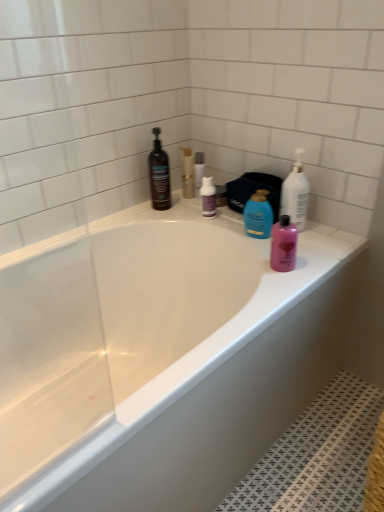
What do you see at coordinates (162, 355) in the screenshot? Image resolution: width=384 pixels, height=512 pixels. I see `white glossy bathtub at upper center` at bounding box center [162, 355].

The height and width of the screenshot is (512, 384). Identify the location of white glossy bathtub at upper center. (162, 355).

Locate an element on the screen. white glossy bottle at upper right, the 4th cleaning product in the left-to-right sequence is located at coordinates (295, 193).

Where is `purple matte bottle at center, which is the 2th cleaning product in left-to-right order`? purple matte bottle at center, which is the 2th cleaning product in left-to-right order is located at coordinates (208, 197).

Find the location of `pink glossy bottle at right, the third toiletry when ordered from left to right`. pink glossy bottle at right, the third toiletry when ordered from left to right is located at coordinates (283, 245).

Image resolution: width=384 pixels, height=512 pixels. Describe the element at coordinates (187, 173) in the screenshot. I see `gold metallic soap dispenser at upper center, marked as the first toiletry in a back-to-front arrangement` at that location.

How much space does gold metallic soap dispenser at upper center, which is the first toiletry in left-to-right order, occupy vertically?

The height of gold metallic soap dispenser at upper center, which is the first toiletry in left-to-right order, is 17.37 centimeters.

Locate an element on the screen. Image resolution: width=384 pixels, height=512 pixels. white glossy bathtub at upper center is located at coordinates [162, 355].

Based on their sizes in the image, would you say pink glossy bottle at right, acting as the first toiletry starting from the front, is bigger or smaller than clear plastic bottle at upper center, the second toiletry viewed from the left?

pink glossy bottle at right, acting as the first toiletry starting from the front, is bigger than clear plastic bottle at upper center, the second toiletry viewed from the left.

The image size is (384, 512). I want to click on the 1st toiletry to the left of the pink glossy bottle at right, acting as the first toiletry starting from the front, counting from the anchor's position, so click(199, 168).

Would you say pink glossy bottle at right, the third toiletry from the back, contains clear plastic bottle at upper center, marked as the 2th toiletry in a top-to-bottom arrangement?

No.

Looking at this image, between pink glossy bottle at right, the first toiletry in the bottom-to-top sequence, and clear plastic bottle at upper center, which is the 2th toiletry from back to front, which one appears on the left side from the viewer's perspective?

clear plastic bottle at upper center, which is the 2th toiletry from back to front, is more to the left.

From a real-world perspective, which object rests below the other?

In real-world perspective, blue glossy bottle at upper center, the second cleaning product when ordered from right to left, is lower.

Considering the relative sizes of blue glossy bottle at upper center, placed as the 3th cleaning product when sorted from left to right, and white glossy bottle at upper right, which ranks as the first cleaning product in right-to-left order, in the image provided, is blue glossy bottle at upper center, placed as the 3th cleaning product when sorted from left to right, wider than white glossy bottle at upper right, which ranks as the first cleaning product in right-to-left order,?

No, blue glossy bottle at upper center, placed as the 3th cleaning product when sorted from left to right, is not wider than white glossy bottle at upper right, which ranks as the first cleaning product in right-to-left order.

From their relative heights in the image, would you say blue glossy bottle at upper center, placed as the 3th cleaning product when sorted from left to right, is taller or shorter than white glossy bottle at upper right, which ranks as the first cleaning product in right-to-left order?

Clearly, blue glossy bottle at upper center, placed as the 3th cleaning product when sorted from left to right, is shorter compared to white glossy bottle at upper right, which ranks as the first cleaning product in right-to-left order.

Would you consider blue glossy bottle at upper center, the second cleaning product when ordered from right to left, to be distant from white glossy bottle at upper right, which ranks as the first cleaning product in right-to-left order?

No, blue glossy bottle at upper center, the second cleaning product when ordered from right to left, is not far away from white glossy bottle at upper right, which ranks as the first cleaning product in right-to-left order.

Is blue glossy bottle at upper center, placed as the 3th cleaning product when sorted from left to right, inside the boundaries of gold metallic soap dispenser at upper center, marked as the 3th toiletry in a right-to-left arrangement, or outside?

blue glossy bottle at upper center, placed as the 3th cleaning product when sorted from left to right, cannot be found inside gold metallic soap dispenser at upper center, marked as the 3th toiletry in a right-to-left arrangement.

From a real-world perspective, is blue glossy bottle at upper center, the second cleaning product when ordered from right to left, positioned above or below gold metallic soap dispenser at upper center, which is the first toiletry in left-to-right order?

blue glossy bottle at upper center, the second cleaning product when ordered from right to left, is situated lower than gold metallic soap dispenser at upper center, which is the first toiletry in left-to-right order, in the real world.

Is blue glossy bottle at upper center, placed as the 3th cleaning product when sorted from left to right, placed right next to gold metallic soap dispenser at upper center, marked as the third toiletry in a front-to-back arrangement?

No, blue glossy bottle at upper center, placed as the 3th cleaning product when sorted from left to right, is not beside gold metallic soap dispenser at upper center, marked as the third toiletry in a front-to-back arrangement.

In the image, is blue glossy bottle at upper center, placed as the 3th cleaning product when sorted from left to right, on the left side or the right side of gold metallic soap dispenser at upper center, marked as the third toiletry in a front-to-back arrangement?

blue glossy bottle at upper center, placed as the 3th cleaning product when sorted from left to right, is positioned on gold metallic soap dispenser at upper center, marked as the third toiletry in a front-to-back arrangement,'s right side.

Is white glossy bottle at upper right, which ranks as the first cleaning product in right-to-left order, at the back of gold metallic soap dispenser at upper center, placed as the third toiletry when sorted from bottom to top?

gold metallic soap dispenser at upper center, placed as the third toiletry when sorted from bottom to top, does not have its back to white glossy bottle at upper right, which ranks as the first cleaning product in right-to-left order.

Is gold metallic soap dispenser at upper center, placed as the third toiletry when sorted from bottom to top, positioned beyond the bounds of white glossy bottle at upper right, which ranks as the first cleaning product in right-to-left order?

gold metallic soap dispenser at upper center, placed as the third toiletry when sorted from bottom to top, is positioned outside white glossy bottle at upper right, which ranks as the first cleaning product in right-to-left order.

From a real-world perspective, is gold metallic soap dispenser at upper center, marked as the first toiletry in a back-to-front arrangement, on white glossy bottle at upper right, the 4th cleaning product in the left-to-right sequence?

No, from a real-world perspective, gold metallic soap dispenser at upper center, marked as the first toiletry in a back-to-front arrangement, is not on top of white glossy bottle at upper right, the 4th cleaning product in the left-to-right sequence.

Can you tell me how much gold metallic soap dispenser at upper center, which is the first toiletry in left-to-right order, and white glossy bottle at upper right, which ranks as the first cleaning product in right-to-left order, differ in facing direction?

0.00207 degrees.

Can you confirm if purple matte bottle at center, which is the 2th cleaning product in left-to-right order, is shorter than white glossy bathtub at upper center?

Correct, purple matte bottle at center, which is the 2th cleaning product in left-to-right order, is not as tall as white glossy bathtub at upper center.

Based on the photo, considering the positions of objects purple matte bottle at center, which is the 2th cleaning product in left-to-right order, and white glossy bathtub at upper center in the image provided, who is more to the right, purple matte bottle at center, which is the 2th cleaning product in left-to-right order, or white glossy bathtub at upper center?

From the viewer's perspective, purple matte bottle at center, which is the 2th cleaning product in left-to-right order, appears more on the right side.

Is purple matte bottle at center, arranged as the third cleaning product when viewed from the right, next to white glossy bathtub at upper center and touching it?

purple matte bottle at center, arranged as the third cleaning product when viewed from the right, and white glossy bathtub at upper center are not in contact.

From a real-world perspective, which cleaning product is the 2nd one above the white glossy bathtub at upper center? Please provide its 2D coordinates.

[(208, 197)]

Which is nearer, (185, 186) or (249, 206)?

Point (185, 186) is farther from the camera than point (249, 206).

From the image's perspective, relative to blue glossy bottle at upper center, placed as the 3th cleaning product when sorted from left to right, is gold metallic soap dispenser at upper center, placed as the third toiletry when sorted from bottom to top, above or below?

Based on their image positions, gold metallic soap dispenser at upper center, placed as the third toiletry when sorted from bottom to top, is located above blue glossy bottle at upper center, placed as the 3th cleaning product when sorted from left to right.

Which is in front, gold metallic soap dispenser at upper center, marked as the first toiletry in a back-to-front arrangement, or blue glossy bottle at upper center, placed as the 3th cleaning product when sorted from left to right?

blue glossy bottle at upper center, placed as the 3th cleaning product when sorted from left to right, is more forward.

Is the surface of blue glossy bottle at upper center, placed as the 3th cleaning product when sorted from left to right, in direct contact with clear plastic bottle at upper center, marked as the 2th toiletry in a top-to-bottom arrangement?

No, blue glossy bottle at upper center, placed as the 3th cleaning product when sorted from left to right, is not making contact with clear plastic bottle at upper center, marked as the 2th toiletry in a top-to-bottom arrangement.

Is clear plastic bottle at upper center, which is counted as the second toiletry, starting from the front, at the back of blue glossy bottle at upper center, placed as the 3th cleaning product when sorted from left to right?

No, blue glossy bottle at upper center, placed as the 3th cleaning product when sorted from left to right, is not facing away from clear plastic bottle at upper center, which is counted as the second toiletry, starting from the front.

Looking at the image, does blue glossy bottle at upper center, placed as the 3th cleaning product when sorted from left to right, seem bigger or smaller compared to clear plastic bottle at upper center, marked as the 2th toiletry in a top-to-bottom arrangement?

In the image, blue glossy bottle at upper center, placed as the 3th cleaning product when sorted from left to right, appears to be larger than clear plastic bottle at upper center, marked as the 2th toiletry in a top-to-bottom arrangement.

Locate an element on the screen. Image resolution: width=384 pixels, height=512 pixels. toiletry that is the 1st one when counting upward from the pink glossy bottle at right, the third toiletry from the back (from the image's perspective) is located at coordinates (199, 168).

I want to click on cleaning product that appears on the right of blue glossy bottle at upper center, the second cleaning product when ordered from right to left, so click(295, 193).

Based on their spatial positions, is purple matte bottle at center, arranged as the third cleaning product when viewed from the right, or blue glossy bottle at upper center, the second cleaning product when ordered from right to left, closer to clear plastic bottle at upper center, the second toiletry viewed from the left?

purple matte bottle at center, arranged as the third cleaning product when viewed from the right, is positioned closer to the anchor clear plastic bottle at upper center, the second toiletry viewed from the left.

Considering their positions, is pink glossy bottle at right, the third toiletry from the back, positioned closer to white glossy bottle at upper right, the 4th cleaning product in the left-to-right sequence, than white glossy bathtub at upper center?

Based on the image, pink glossy bottle at right, the third toiletry from the back, appears to be nearer to white glossy bottle at upper right, the 4th cleaning product in the left-to-right sequence.

Considering their positions, is gold metallic soap dispenser at upper center, which is counted as the first toiletry, starting from the top, positioned further to pink glossy bottle at right, arranged as the 1th toiletry when viewed from the right, than clear plastic bottle at upper center, which is counted as the second toiletry, starting from the front?

gold metallic soap dispenser at upper center, which is counted as the first toiletry, starting from the top, is further to pink glossy bottle at right, arranged as the 1th toiletry when viewed from the right.

Based on their spatial positions, is blue glossy bottle at upper center, the second cleaning product when ordered from right to left, or matte black bottle at upper left, the 4th cleaning product when ordered from right to left, further from purple matte bottle at center, arranged as the third cleaning product when viewed from the right?

The object further to purple matte bottle at center, arranged as the third cleaning product when viewed from the right, is matte black bottle at upper left, the 4th cleaning product when ordered from right to left.

Based on the photo, estimate the real-world distances between objects in this image. Which object is closer to pink glossy bottle at right, which ranks as the 3th toiletry in top-to-bottom order, matte black bottle at upper left, the 4th cleaning product when ordered from right to left, or white glossy bathtub at upper center?

white glossy bathtub at upper center is positioned closer to the anchor pink glossy bottle at right, which ranks as the 3th toiletry in top-to-bottom order.

Considering their positions, is purple matte bottle at center, arranged as the third cleaning product when viewed from the right, positioned further to matte black bottle at upper left, the 4th cleaning product when ordered from right to left, than blue glossy bottle at upper center, placed as the 3th cleaning product when sorted from left to right?

Based on the image, blue glossy bottle at upper center, placed as the 3th cleaning product when sorted from left to right, appears to be further to matte black bottle at upper left, the 4th cleaning product when ordered from right to left.

Looking at the image, which one is located further to blue glossy bottle at upper center, placed as the 3th cleaning product when sorted from left to right, gold metallic soap dispenser at upper center, marked as the first toiletry in a back-to-front arrangement, or purple matte bottle at center, arranged as the third cleaning product when viewed from the right?

gold metallic soap dispenser at upper center, marked as the first toiletry in a back-to-front arrangement, is further to blue glossy bottle at upper center, placed as the 3th cleaning product when sorted from left to right.

Estimate the real-world distances between objects in this image. Which object is closer to white glossy bathtub at upper center, blue glossy bottle at upper center, placed as the 3th cleaning product when sorted from left to right, or gold metallic soap dispenser at upper center, marked as the 3th toiletry in a right-to-left arrangement?

blue glossy bottle at upper center, placed as the 3th cleaning product when sorted from left to right, lies closer to white glossy bathtub at upper center than the other object.

You are a GUI agent. You are given a task and a screenshot of the screen. Output one action in this format:
    pyautogui.click(x=<x>, y=<y>)
    Task: Click on the toiletry between white glossy bathtub at upper center and purple matte bottle at center, which is the 2th cleaning product in left-to-right order, from front to back
    The height and width of the screenshot is (512, 384).
    Given the screenshot: What is the action you would take?
    point(283,245)

You are a GUI agent. You are given a task and a screenshot of the screen. Output one action in this format:
    pyautogui.click(x=<x>, y=<y>)
    Task: Click on the cleaning product between white glossy bathtub at upper center and blue glossy bottle at upper center, placed as the 3th cleaning product when sorted from left to right, from front to back
    This screenshot has height=512, width=384.
    Given the screenshot: What is the action you would take?
    pyautogui.click(x=295, y=193)

Where is `cleaning product situated between purple matte bottle at center, arranged as the third cleaning product when viewed from the right, and white glossy bottle at upper right, the 4th cleaning product in the left-to-right sequence, from left to right`? The image size is (384, 512). cleaning product situated between purple matte bottle at center, arranged as the third cleaning product when viewed from the right, and white glossy bottle at upper right, the 4th cleaning product in the left-to-right sequence, from left to right is located at coordinates (258, 215).

You are a GUI agent. You are given a task and a screenshot of the screen. Output one action in this format:
    pyautogui.click(x=<x>, y=<y>)
    Task: Click on the toiletry positioned between blue glossy bottle at upper center, the second cleaning product when ordered from right to left, and gold metallic soap dispenser at upper center, placed as the third toiletry when sorted from bottom to top, from near to far
    The image size is (384, 512).
    Given the screenshot: What is the action you would take?
    pyautogui.click(x=199, y=168)